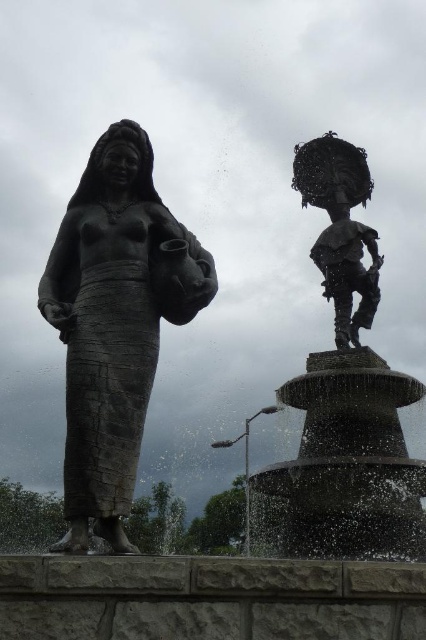
You are standing in front of the image and want to locate the bronze statue at left. Can you determine its exact 2D coordinates based on the image?

The bronze statue at left is located at the 2D coordinates of point [115,323].